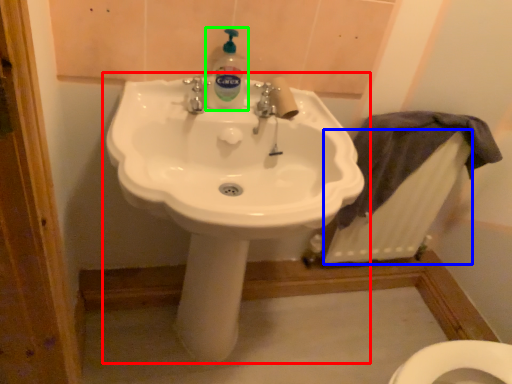
Question: Which object is positioned farthest from sink (highlighted by a red box)? Select from radiator (highlighted by a blue box) and cleaning product (highlighted by a green box).

Choices:
 (A) radiator
 (B) cleaning product

Answer: (A)